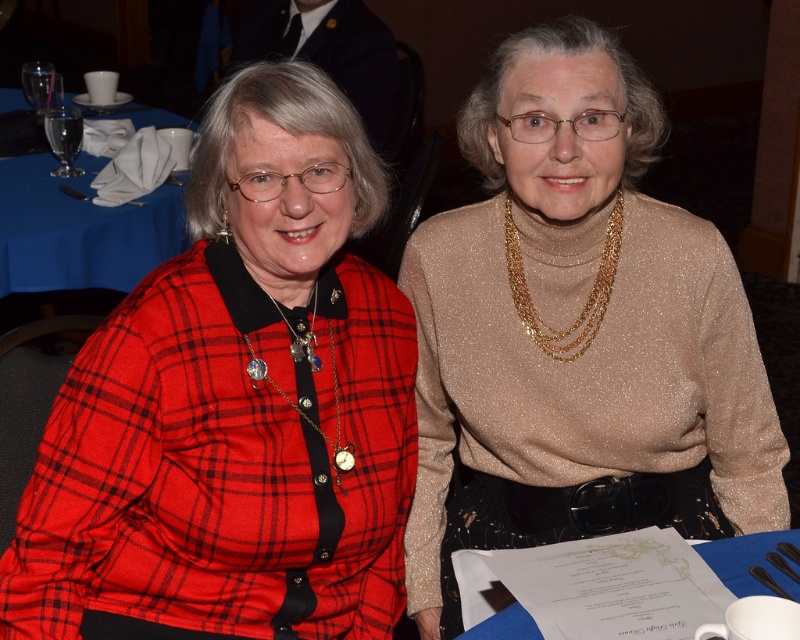
You are a photographer at the event and need to adjust the camera focus. Since the red plaid shirt at left and the silver metallic chain with pendants at center are both in the frame, which object should you focus on first if you want to prioritize the taller one?

The red plaid shirt at left is taller than the silver metallic chain with pendants at center, so you should focus on the red plaid shirt at left first.

You are a fashion designer observing two items at a table during an event. You see the red plaid shirt at left and the silver metallic chain with pendants at center. Which item has a greater width?

The red plaid shirt at left has a greater width than the silver metallic chain with pendants at center.